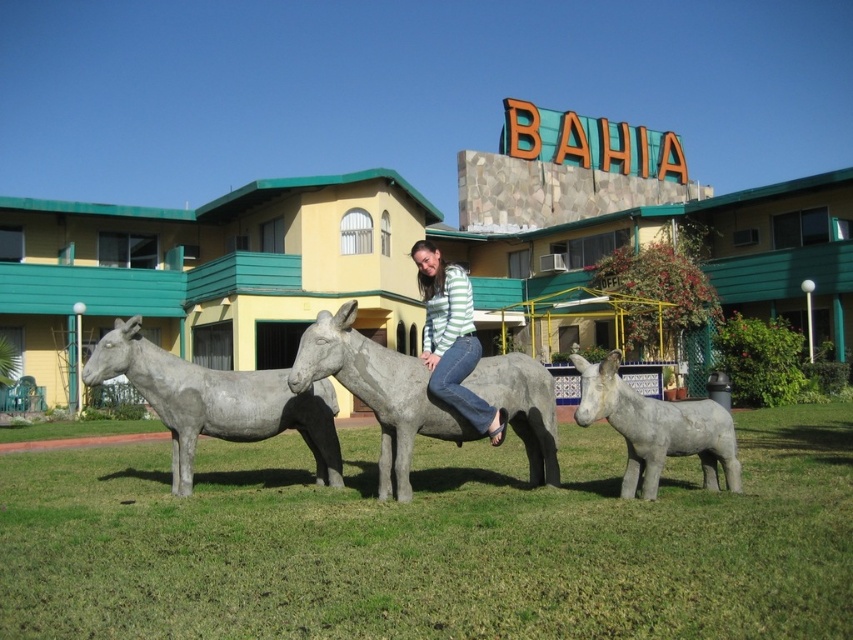
You are standing at the center of the grassy lawn in the foreground of the image. You want to take a photo of the gray stone donkey at lower right. In which direction should you walk to get closer to it?

The gray stone donkey at lower right is located at point 0.670 on the x axis and 0.770 on the y axis. Since you are at the center, you should walk towards the lower right direction to reach it.

You are standing in the park and see the gray stone mule at center and the gray stone donkey at lower right. Which one is positioned further away from you?

The gray stone donkey at lower right is positioned further away from you because it is behind the gray stone mule at center.

You are standing at the point labeled as point (476, 353) and want to walk towards the statue of a donkey in the center. Which direction should you move relative to the point (647, 445)?

You should move towards point (647, 445) because it is in front of point (476, 353) and closer to the statue of a donkey in the center.